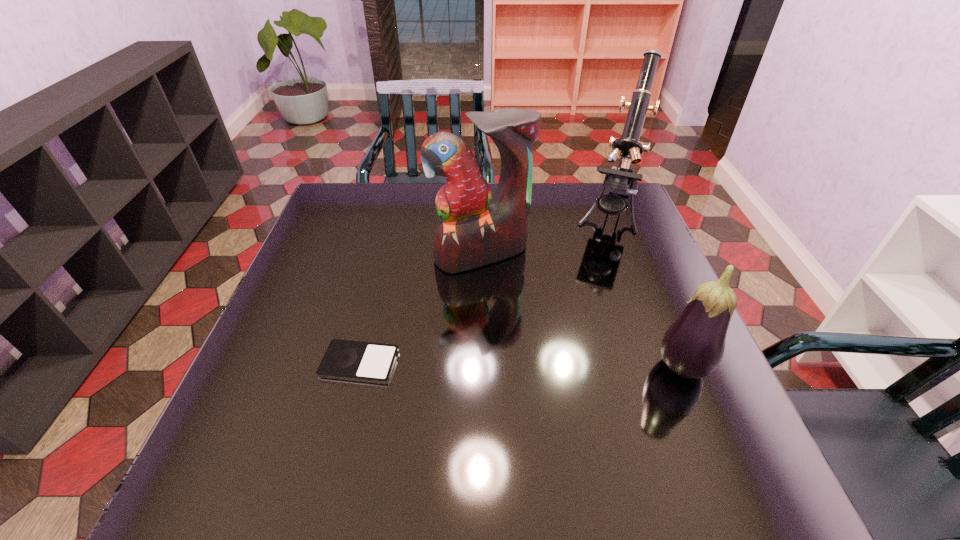
The image size is (960, 540). Find the location of `free space on the desktop that is between the iPod and the second shortest object and is positioned at the face of the third object from right to left`. free space on the desktop that is between the iPod and the second shortest object and is positioned at the face of the third object from right to left is located at coordinates (554, 367).

Locate an element on the screen. The width and height of the screenshot is (960, 540). free space on the desktop that is between the leftmost object and the eggplant and is positioned through the eyepiece of the microscope is located at coordinates (552, 367).